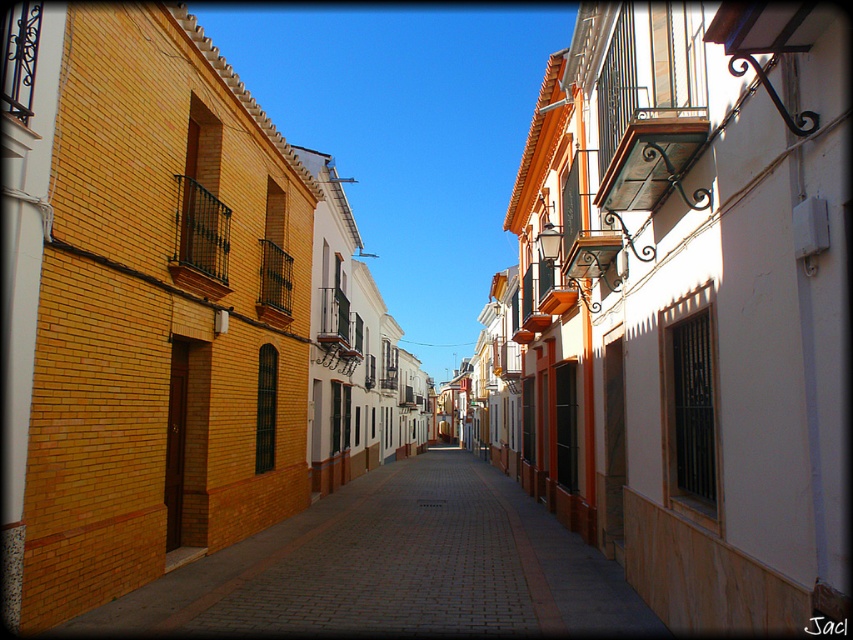
Can you confirm if white textured wall at center is thinner than brick pavement at center?

Indeed, white textured wall at center has a lesser width compared to brick pavement at center.

Is the position of white textured wall at center more distant than that of brick pavement at center?

That is False.

Is point (740, 536) in front of point (340, 557)?

Yes.

You are a GUI agent. You are given a task and a screenshot of the screen. Output one action in this format:
    pyautogui.click(x=<x>, y=<y>)
    Task: Click on the white textured wall at center
    Image resolution: width=853 pixels, height=640 pixels.
    Given the screenshot: What is the action you would take?
    pyautogui.click(x=689, y=305)